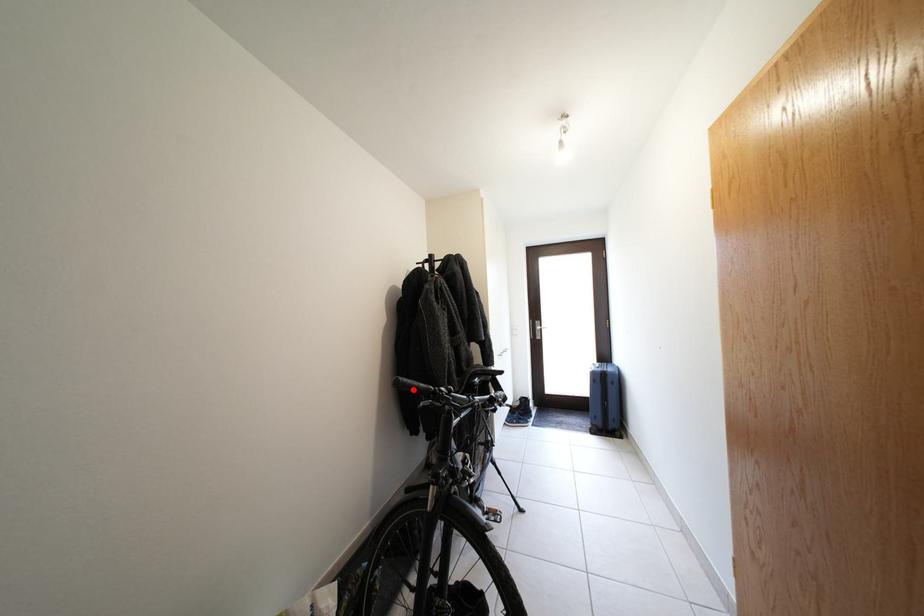
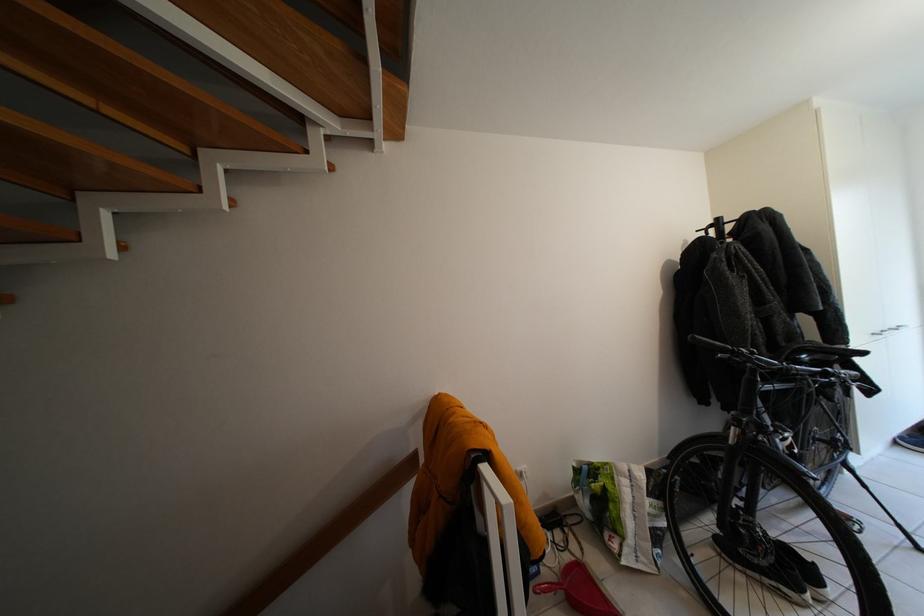
Find the pixel in the second image that matches the highlighted location in the first image.

(710, 345)